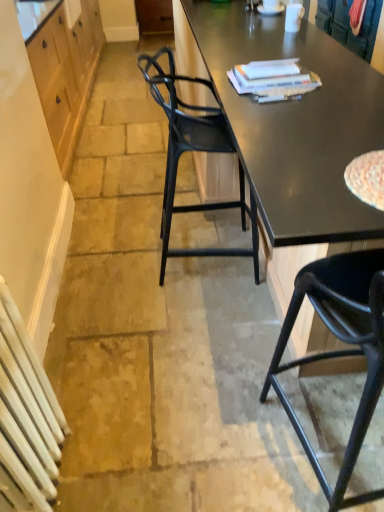
This screenshot has height=512, width=384. In order to click on vacant space behind white painted metal radiator at lower left in this screenshot , I will do `click(87, 402)`.